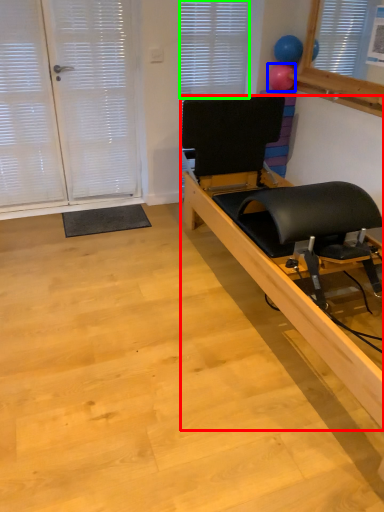
Question: Based on their relative distances, which object is nearer to furniture (highlighted by a red box)? Choose from balloon (highlighted by a blue box) and blind (highlighted by a green box).

Choices:
 (A) balloon
 (B) blind

Answer: (B)